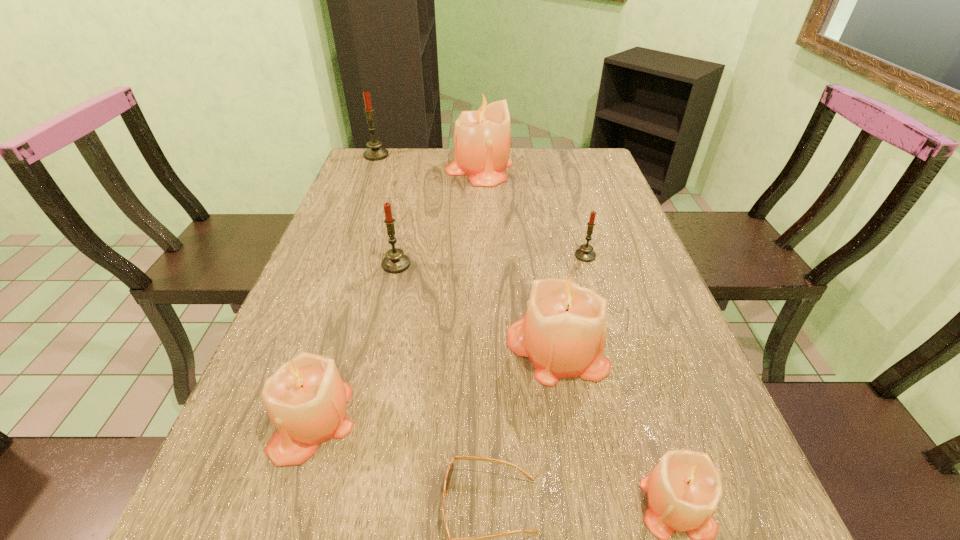
Identify which beige candle is the third closest to the biggest beige candle. Please provide its 2D coordinates. Your answer should be formatted as a tuple, i.e. [(x, y)], where the tuple contains the x and y coordinates of a point satisfying the conditions above.

[(683, 490)]

Select which red candle is the second closest to the smallest red candle. Please provide its 2D coordinates. Your answer should be formatted as a tuple, i.e. [(x, y)], where the tuple contains the x and y coordinates of a point satisfying the conditions above.

[(375, 152)]

Locate an element on the screen. The height and width of the screenshot is (540, 960). red candle that is the closest to the rightmost red candle is located at coordinates (395, 261).

At what (x,y) coordinates should I click in order to perform the action: click on free point that satisfies the following two spatial constraints: 1. on the back side of the second smallest beige candle; 2. on the left side of the third smallest beige candle. Please return your answer as a coordinate pair (x, y). This screenshot has height=540, width=960. Looking at the image, I should click on (334, 349).